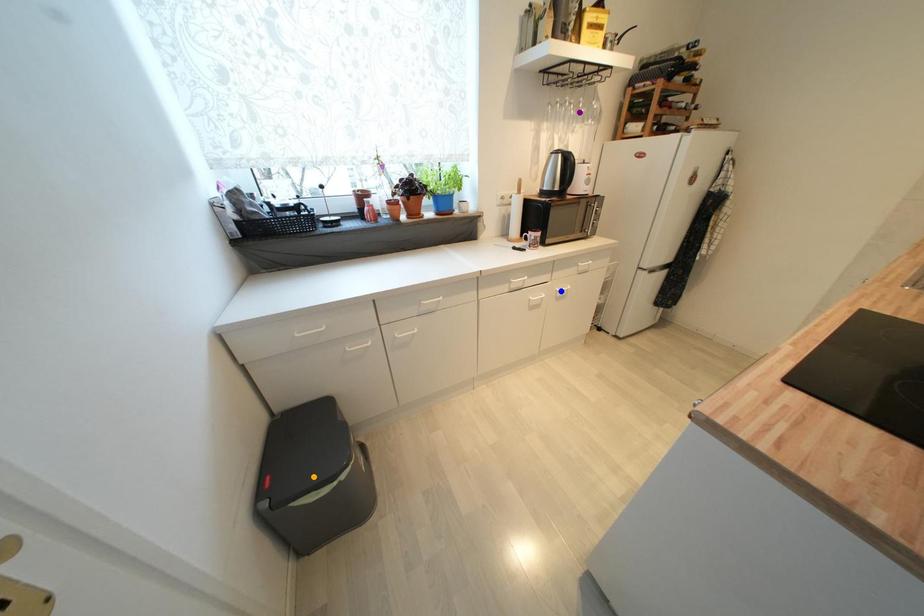
In the scene shown: Order these from nearest to farthest:
1. orange point
2. purple point
3. blue point

orange point
blue point
purple point